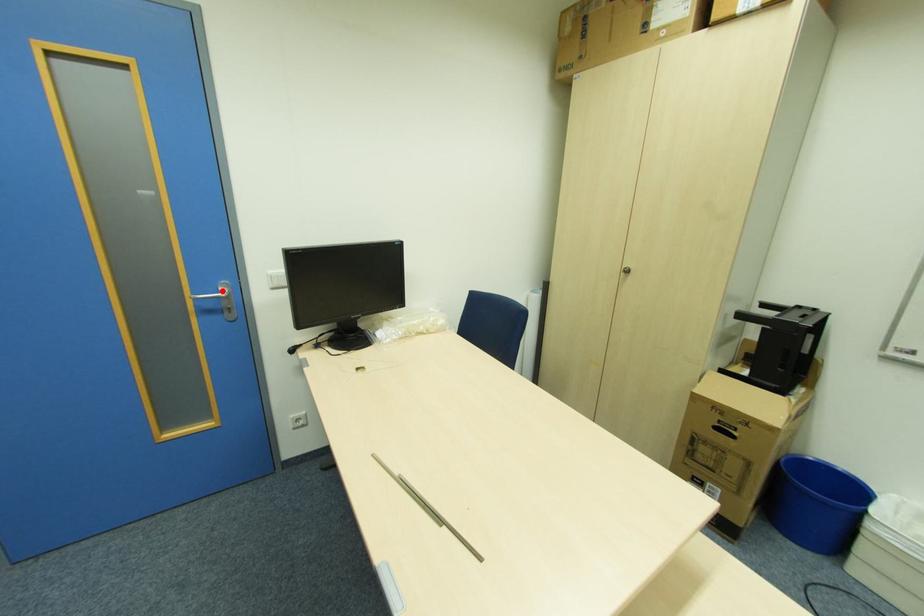
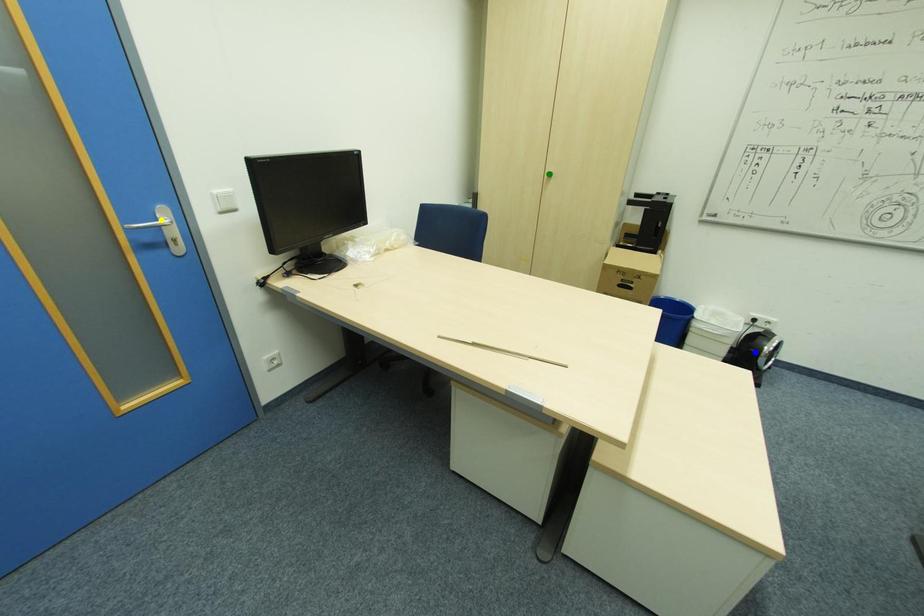
Question: I am providing you with two images of the same scene from different viewpoints. A red point is marked on the first image. You are given multiple points on the second image. Which mark in image 2 goes with the point in image 1?

Choices:
 (A) yellow point
 (B) blue point
 (C) green point

Answer: (A)